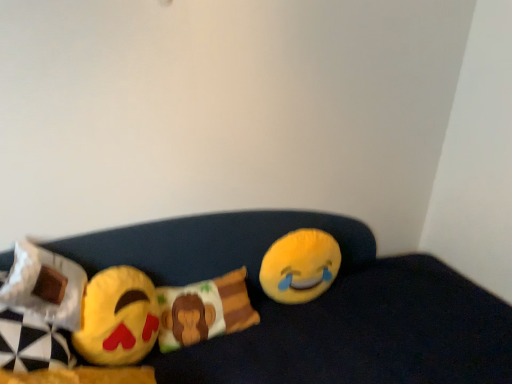
Question: From the image's perspective, is white fabric pillow at left, the 1th pillow viewed from the front, over matte yellow emoji at left, acting as the 2th toy starting from the back?

Choices:
 (A) yes
 (B) no

Answer: (A)

Question: Is white fabric pillow at left, the first pillow viewed from the left, to the right of matte yellow emoji at left, which is the first toy from left to right, from the viewer's perspective?

Choices:
 (A) yes
 (B) no

Answer: (B)

Question: Does white fabric pillow at left, acting as the second pillow starting from the back, have a lesser height compared to matte yellow emoji at left, which is the first toy from left to right?

Choices:
 (A) yes
 (B) no

Answer: (A)

Question: From the image's perspective, is white fabric pillow at left, the 1th pillow viewed from the front, under matte yellow emoji at left, which is the first toy from left to right?

Choices:
 (A) no
 (B) yes

Answer: (A)

Question: Could matte yellow emoji at left, acting as the 2th toy starting from the back, be considered to be inside white fabric pillow at left, the 1th pillow viewed from the front?

Choices:
 (A) no
 (B) yes

Answer: (A)

Question: Is white fabric pillow at left, the first pillow viewed from the left, beside matte yellow emoji at left, which appears as the 1th toy when viewed from the front?

Choices:
 (A) no
 (B) yes

Answer: (A)

Question: Does white fabric pillow at left, acting as the second pillow starting from the back, touch yellow plush emoji at center?

Choices:
 (A) yes
 (B) no

Answer: (B)

Question: Can you confirm if white fabric pillow at left, the 1th pillow viewed from the front, is smaller than yellow plush emoji at center?

Choices:
 (A) no
 (B) yes

Answer: (B)

Question: From the image's perspective, is white fabric pillow at left, acting as the second pillow starting from the back, above yellow plush emoji at center?

Choices:
 (A) no
 (B) yes

Answer: (B)

Question: Considering the relative sizes of white fabric pillow at left, positioned as the second pillow in right-to-left order, and yellow plush emoji at center in the image provided, is white fabric pillow at left, positioned as the second pillow in right-to-left order, wider than yellow plush emoji at center?

Choices:
 (A) yes
 (B) no

Answer: (B)

Question: Does white fabric pillow at left, the first pillow viewed from the left, lie behind yellow plush emoji at center?

Choices:
 (A) no
 (B) yes

Answer: (B)

Question: From the image's perspective, would you say white fabric pillow at left, the 1th pillow viewed from the front, is shown under yellow plush emoji at center?

Choices:
 (A) yes
 (B) no

Answer: (B)

Question: Is yellow plush at right, positioned as the second toy in left-to-right order, positioned beyond the bounds of white fabric pillow at left, the 1th pillow viewed from the front?

Choices:
 (A) no
 (B) yes

Answer: (B)